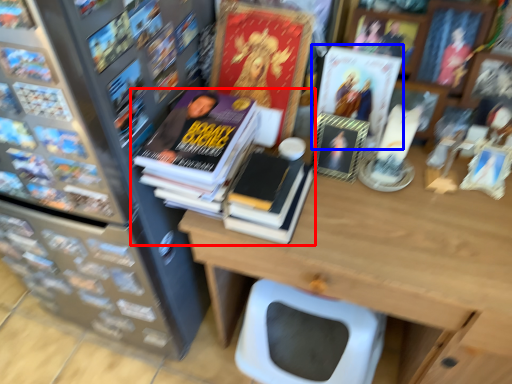
Question: Among these objects, which one is nearest to the camera, book (highlighted by a red box) or book cover (highlighted by a blue box)?

Choices:
 (A) book
 (B) book cover

Answer: (A)